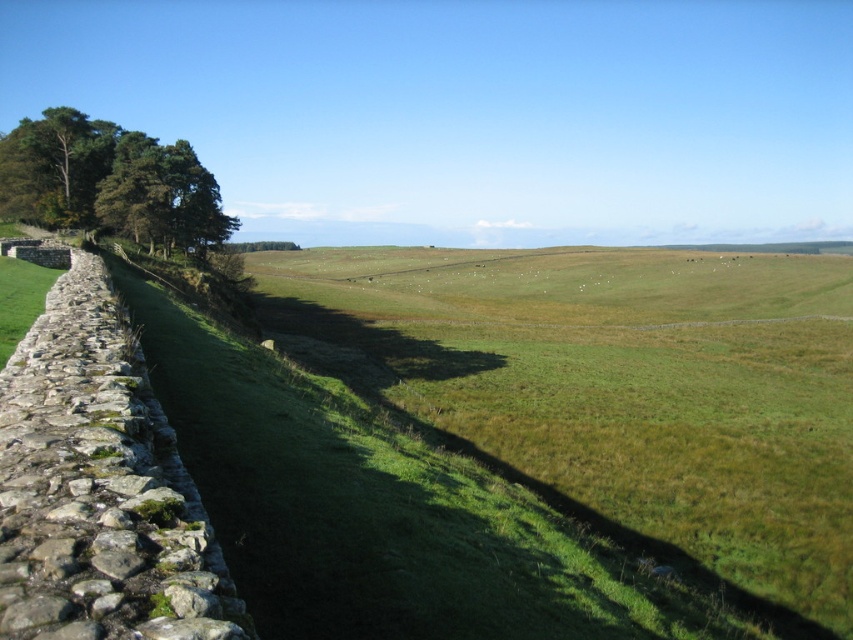
Question: Does green grassy field at center appear under green leafy tree at upper left?

Choices:
 (A) yes
 (B) no

Answer: (A)

Question: Does green grassy field at center have a greater width compared to green leafy tree at upper left?

Choices:
 (A) no
 (B) yes

Answer: (B)

Question: Can you confirm if green grassy field at center is bigger than green leafy tree at upper left?

Choices:
 (A) no
 (B) yes

Answer: (B)

Question: Which point is farther from the camera taking this photo?

Choices:
 (A) (752, 371)
 (B) (184, 230)

Answer: (B)

Question: Among these points, which one is farthest from the camera?

Choices:
 (A) (712, 509)
 (B) (198, 188)

Answer: (B)